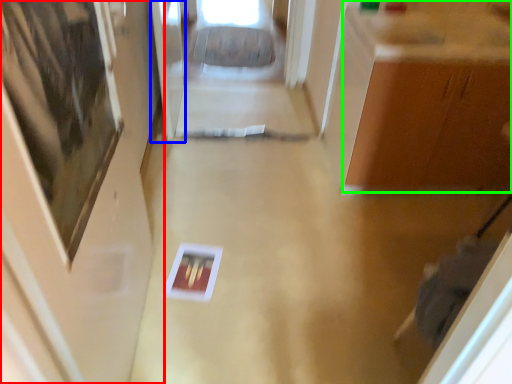
Question: Which is farther away from door (highlighted by a red box)? glass door (highlighted by a blue box) or cabinetry (highlighted by a green box)?

Choices:
 (A) glass door
 (B) cabinetry

Answer: (B)